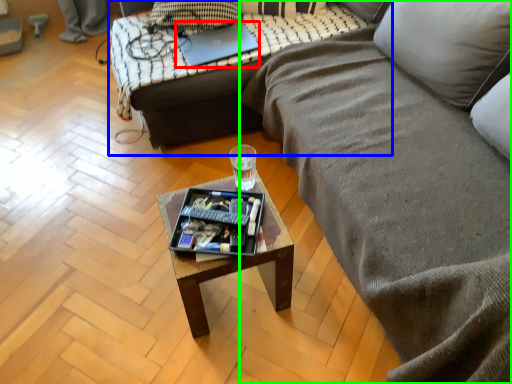
Question: Which object is positioned closest to laptop (highlighted by a red box)? Select from studio couch (highlighted by a blue box) and studio couch (highlighted by a green box).

Choices:
 (A) studio couch
 (B) studio couch

Answer: (A)